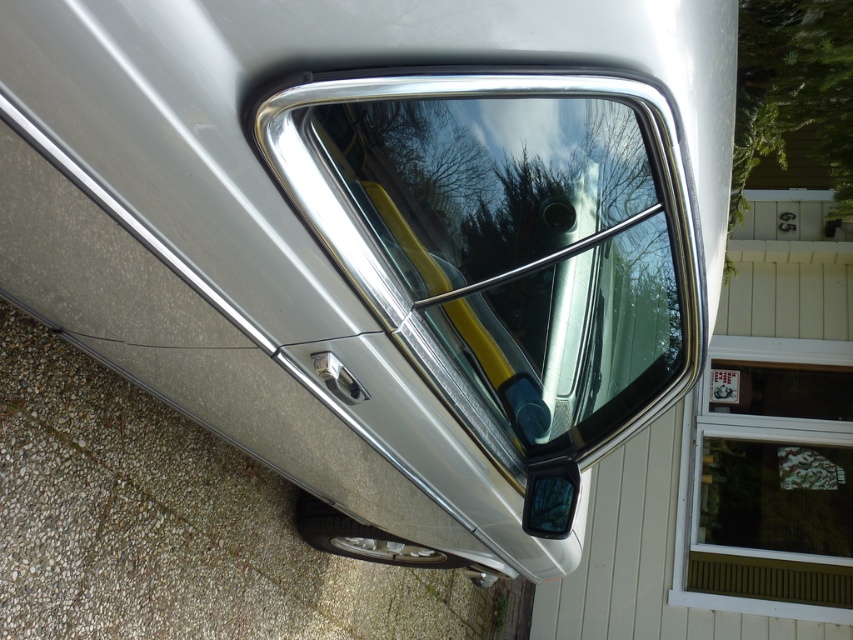
Is point (717, 605) positioned in front of point (529, 524)?

No, it is not.

Which of these two, white plastic window at upper right or glossy plastic mirror at lower right, stands taller?

Standing taller between the two is white plastic window at upper right.

The image size is (853, 640). What do you see at coordinates (767, 481) in the screenshot? I see `white plastic window at upper right` at bounding box center [767, 481].

Where is `white plastic window at upper right`? Image resolution: width=853 pixels, height=640 pixels. white plastic window at upper right is located at coordinates (767, 481).

Is polished chrome window at center bigger than white plastic window at upper right?

No.

Who is lower down, polished chrome window at center or white plastic window at upper right?

white plastic window at upper right is lower down.

Describe the element at coordinates (508, 243) in the screenshot. The image size is (853, 640). I see `polished chrome window at center` at that location.

The image size is (853, 640). I want to click on polished chrome window at center, so click(508, 243).

Does polished chrome window at center appear under glossy plastic mirror at lower right?

Actually, polished chrome window at center is above glossy plastic mirror at lower right.

In the scene shown: Does polished chrome window at center have a greater width compared to glossy plastic mirror at lower right?

Yes.

This screenshot has height=640, width=853. What do you see at coordinates (508, 243) in the screenshot? I see `polished chrome window at center` at bounding box center [508, 243].

The height and width of the screenshot is (640, 853). I want to click on polished chrome window at center, so click(x=508, y=243).